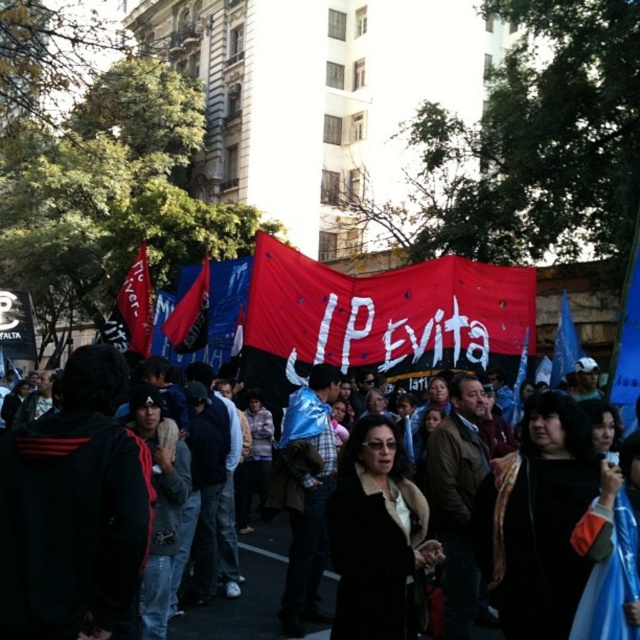
Question: Among these points, which one is farthest from the camera?

Choices:
 (A) (12, 508)
 (B) (296, 342)

Answer: (B)

Question: Which object is farther from the camera taking this photo?

Choices:
 (A) blue fabric flag at center
 (B) red fabric flag at left

Answer: (B)

Question: Can you confirm if black fabric banner at center is positioned below blue fabric flag at center?

Choices:
 (A) yes
 (B) no

Answer: (A)

Question: Observing the image, what is the correct spatial positioning of red fabric banner at center in reference to red fabric flag at center?

Choices:
 (A) above
 (B) below

Answer: (A)

Question: Which object appears closest to the camera in this image?

Choices:
 (A) red fabric flag at center
 (B) red fabric flag at left
 (C) red fabric banner at center

Answer: (C)

Question: Does red fabric flag at left appear over blue fabric flag at center?

Choices:
 (A) no
 (B) yes

Answer: (B)